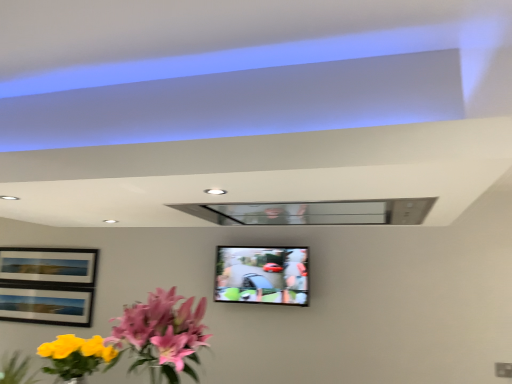
Question: Is pink glossy flowers at lower left at the back of matte black tv at center?

Choices:
 (A) no
 (B) yes

Answer: (A)

Question: From a real-world perspective, is matte black tv at center on top of pink glossy flowers at lower left?

Choices:
 (A) yes
 (B) no

Answer: (A)

Question: Is matte black tv at center outside pink glossy flowers at lower left?

Choices:
 (A) yes
 (B) no

Answer: (A)

Question: Is matte black tv at center closer to the viewer compared to pink glossy flowers at lower left?

Choices:
 (A) no
 (B) yes

Answer: (A)

Question: Is matte black tv at center touching pink glossy flowers at lower left?

Choices:
 (A) yes
 (B) no

Answer: (B)

Question: Considering the relative positions of matte black tv at center and pink glossy flowers at lower left in the image provided, is matte black tv at center to the right of pink glossy flowers at lower left from the viewer's perspective?

Choices:
 (A) no
 (B) yes

Answer: (B)

Question: Is pink glossy flowers at lower left not close to matte black tv at center?

Choices:
 (A) no
 (B) yes

Answer: (B)

Question: Considering the relative positions of pink glossy flowers at lower left and matte black tv at center in the image provided, is pink glossy flowers at lower left to the left of matte black tv at center from the viewer's perspective?

Choices:
 (A) yes
 (B) no

Answer: (A)

Question: From the image's perspective, is pink glossy flowers at lower left over matte black tv at center?

Choices:
 (A) no
 (B) yes

Answer: (A)

Question: Is pink glossy flowers at lower left in contact with matte black tv at center?

Choices:
 (A) yes
 (B) no

Answer: (B)

Question: Does pink glossy flowers at lower left contain matte black tv at center?

Choices:
 (A) no
 (B) yes

Answer: (A)

Question: Is pink glossy flowers at lower left oriented away from matte black tv at center?

Choices:
 (A) yes
 (B) no

Answer: (A)

Question: In terms of height, does pink glossy flowers at lower left look taller or shorter compared to matte black tv at center?

Choices:
 (A) tall
 (B) short

Answer: (A)